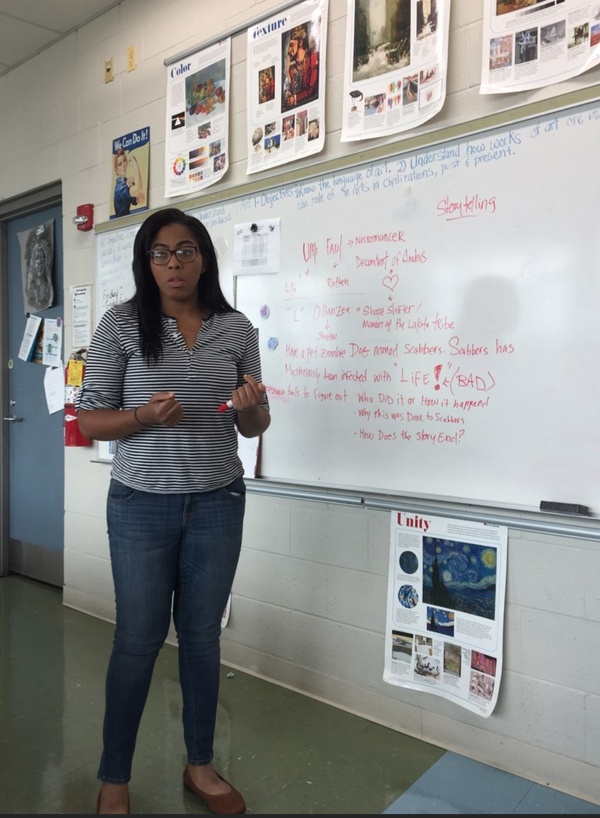
The width and height of the screenshot is (600, 818). Identify the location of posters. (545, 19), (367, 65), (309, 56), (215, 146), (437, 591), (135, 156).